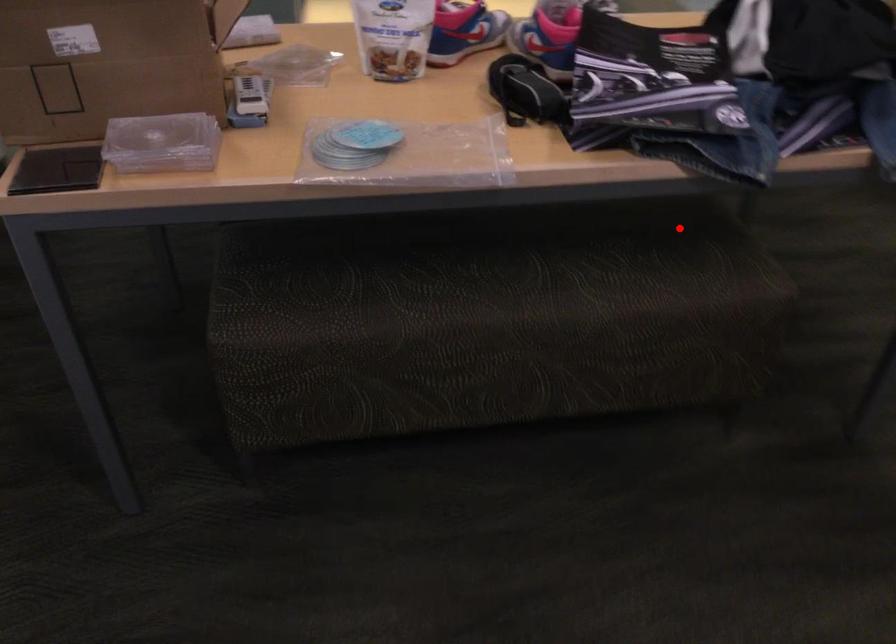
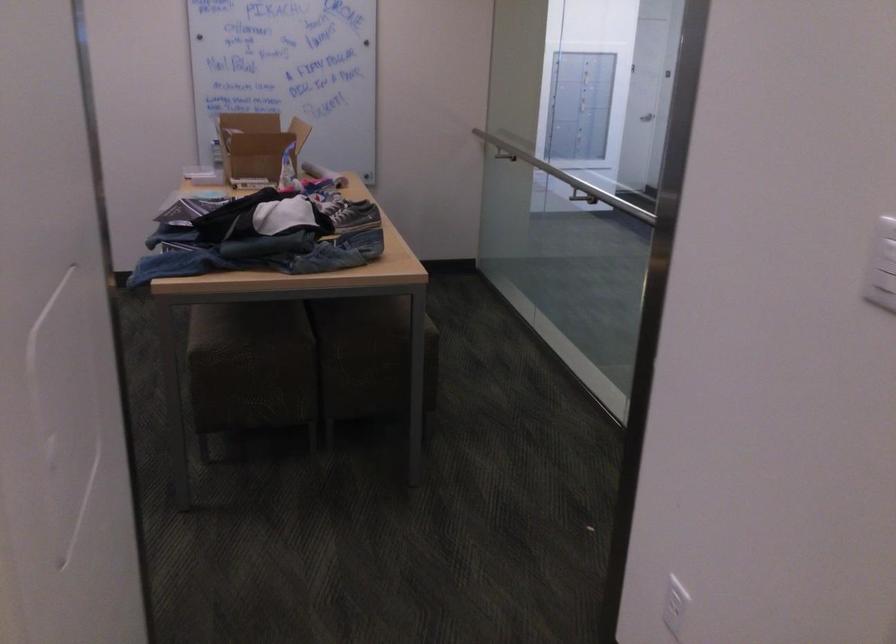
Question: I am providing you with two images of the same scene from different viewpoints. Given a red point in image1, look at the same physical point in image2. Is it:

Choices:
 (A) Closer to the viewpoint
 (B) Farther from the viewpoint

Answer: (B)